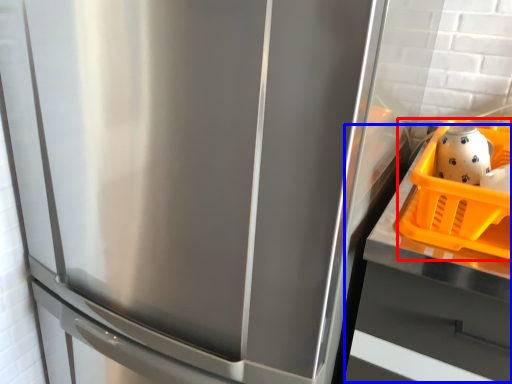
Question: Which object appears closest to the camera in this image, basket (highlighted by a red box) or counter top (highlighted by a blue box)?

Choices:
 (A) basket
 (B) counter top

Answer: (B)